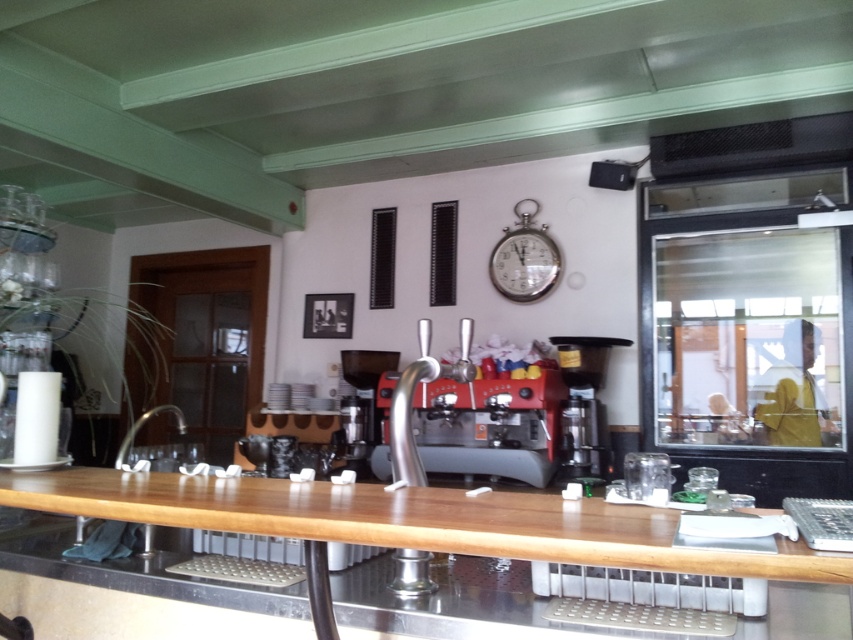
Question: Which object is the farthest from the black plastic coffee machine at center?

Choices:
 (A) wooden at center
 (B) silver metallic clock at upper center

Answer: (A)

Question: Which point is closer to the camera taking this photo?

Choices:
 (A) (550, 280)
 (B) (582, 557)
 (C) (590, 440)

Answer: (B)

Question: Is black plastic coffee machine at center positioned in front of silver metallic clock at upper center?

Choices:
 (A) yes
 (B) no

Answer: (A)

Question: Which of the following is the farthest from the observer?

Choices:
 (A) (543, 518)
 (B) (502, 248)

Answer: (B)

Question: Is black plastic coffee machine at center to the left of silver metallic clock at upper center from the viewer's perspective?

Choices:
 (A) no
 (B) yes

Answer: (A)

Question: Can you confirm if wooden at center is positioned to the right of silver metallic clock at upper center?

Choices:
 (A) no
 (B) yes

Answer: (A)